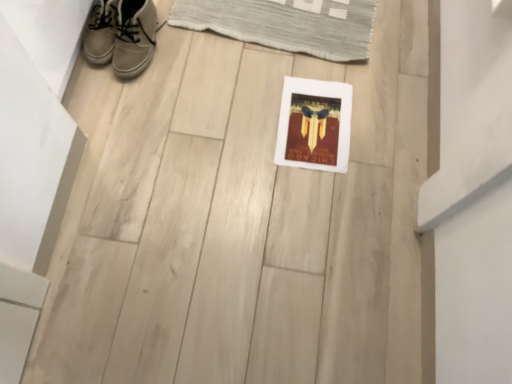
Locate an element on the screen. empty space that is to the right of white leather sneakers at upper left, which is the 2th footwear from left to right is located at coordinates (196, 21).